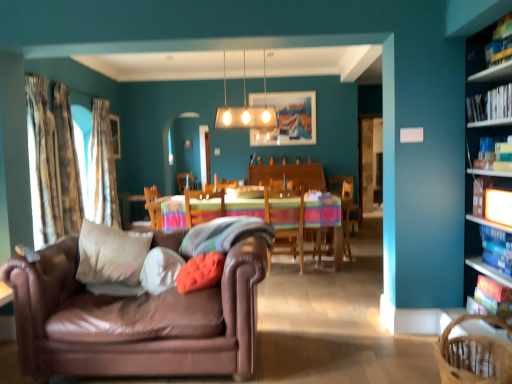
Question: Can you confirm if hardcover book at right, the fifth book when ordered from top to bottom, is bigger than velvety orange pillow at center, positioned as the first pillow in right-to-left order?

Choices:
 (A) no
 (B) yes

Answer: (A)

Question: Is hardcover book at right, which appears as the 1th book when ordered from the bottom, to the right of velvety orange pillow at center, positioned as the first pillow in right-to-left order, from the viewer's perspective?

Choices:
 (A) no
 (B) yes

Answer: (B)

Question: Considering the relative positions of hardcover book at right, which appears as the 1th book when ordered from the bottom, and velvety orange pillow at center, the 4th pillow in the left-to-right sequence, in the image provided, is hardcover book at right, which appears as the 1th book when ordered from the bottom, to the left of velvety orange pillow at center, the 4th pillow in the left-to-right sequence, from the viewer's perspective?

Choices:
 (A) yes
 (B) no

Answer: (B)

Question: From a real-world perspective, is hardcover book at right, the fifth book when ordered from top to bottom, over velvety orange pillow at center, the 4th pillow in the left-to-right sequence?

Choices:
 (A) yes
 (B) no

Answer: (B)

Question: Is hardcover book at right, the fifth book when ordered from top to bottom, facing away from velvety orange pillow at center, positioned as the first pillow in right-to-left order?

Choices:
 (A) no
 (B) yes

Answer: (A)

Question: Based on their sizes in the image, would you say white soft cushion at center, the fourth pillow when ordered from right to left, is bigger or smaller than wooden chair at center, which is the second chair in left-to-right order?

Choices:
 (A) small
 (B) big

Answer: (A)

Question: Would you say white soft cushion at center, which is the 1th pillow from left to right, is inside or outside wooden chair at center, which is the second chair in left-to-right order?

Choices:
 (A) outside
 (B) inside

Answer: (A)

Question: Is white soft cushion at center, the fourth pillow when ordered from right to left, wider or thinner than wooden chair at center, which is the 1th chair in right-to-left order?

Choices:
 (A) wide
 (B) thin

Answer: (B)

Question: Is white soft cushion at center, the fourth pillow when ordered from right to left, taller or shorter than wooden chair at center, which is the second chair in left-to-right order?

Choices:
 (A) tall
 (B) short

Answer: (B)

Question: From a real-world perspective, is white soft cushion at center, the fourth pillow when ordered from right to left, positioned above or below white glossy rectangular light fixture at upper center?

Choices:
 (A) below
 (B) above

Answer: (A)

Question: Considering the positions of white soft cushion at center, which is the 1th pillow from left to right, and white glossy rectangular light fixture at upper center in the image, is white soft cushion at center, which is the 1th pillow from left to right, wider or thinner than white glossy rectangular light fixture at upper center?

Choices:
 (A) wide
 (B) thin

Answer: (A)

Question: Considering the positions of point (99, 286) and point (221, 122), is point (99, 286) closer or farther from the camera than point (221, 122)?

Choices:
 (A) closer
 (B) farther

Answer: (A)

Question: From the image's perspective, is white soft cushion at center, the fourth pillow when ordered from right to left, located above or below white glossy rectangular light fixture at upper center?

Choices:
 (A) above
 (B) below

Answer: (B)

Question: From a real-world perspective, is hardcover book at upper right, arranged as the 2th book when viewed from the top, above or below hardcover book at upper right, acting as the 3th book starting from the bottom?

Choices:
 (A) above
 (B) below

Answer: (A)

Question: Does point (486, 112) appear closer or farther from the camera than point (489, 160)?

Choices:
 (A) farther
 (B) closer

Answer: (B)